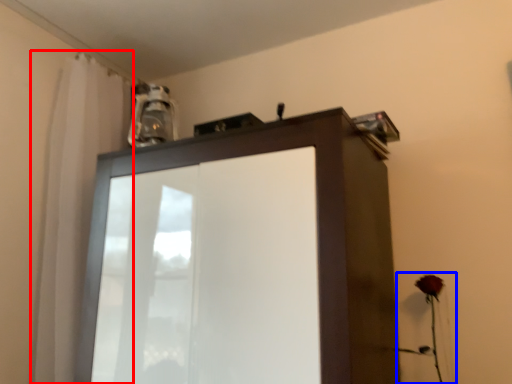
Question: Which of the following is the closest to the observer, shower curtain (highlighted by a red box) or flower (highlighted by a blue box)?

Choices:
 (A) shower curtain
 (B) flower

Answer: (B)